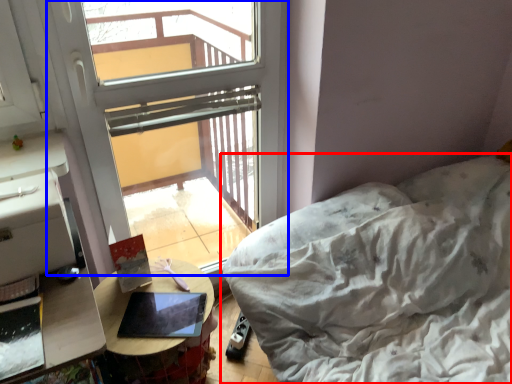
Question: Which point is further to the camera, furniture (highlighted by a red box) or window (highlighted by a blue box)?

Choices:
 (A) furniture
 (B) window

Answer: (B)